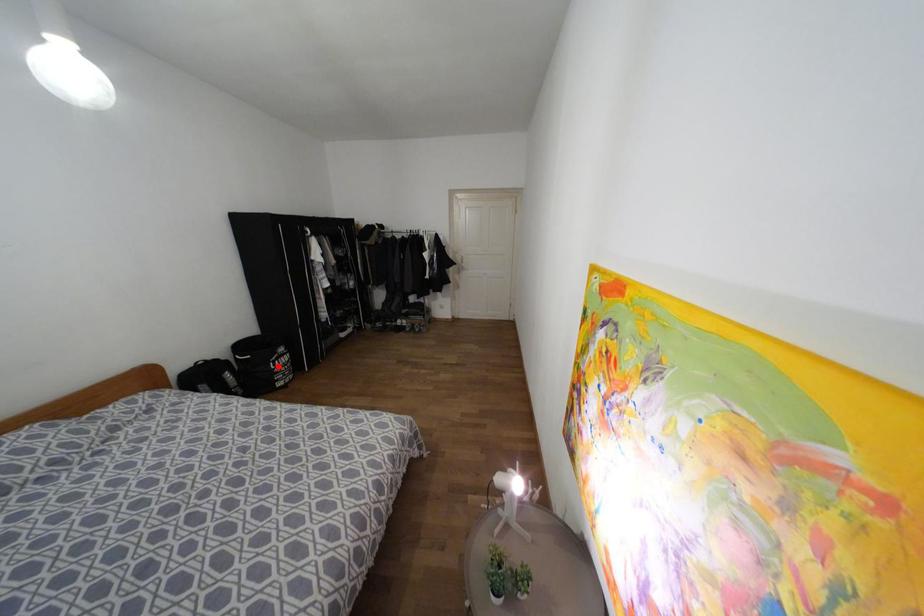
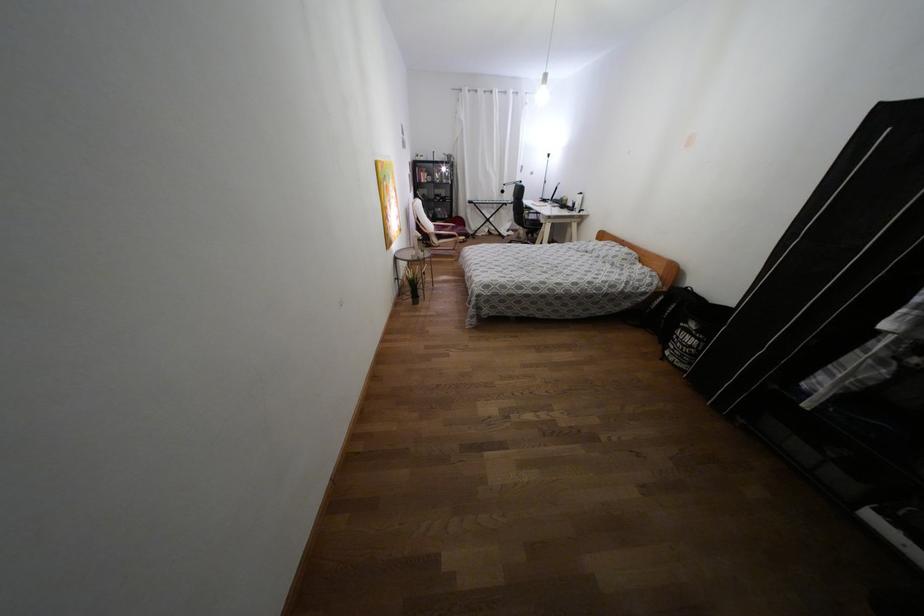
Question: I am providing you with two images of the same scene from different viewpoints. Image1 has a red point marked. In image2, the corresponding 3D location appears at what relative position? Reply with the corresponding letter.

Choices:
 (A) Closer
 (B) Farther

Answer: (A)